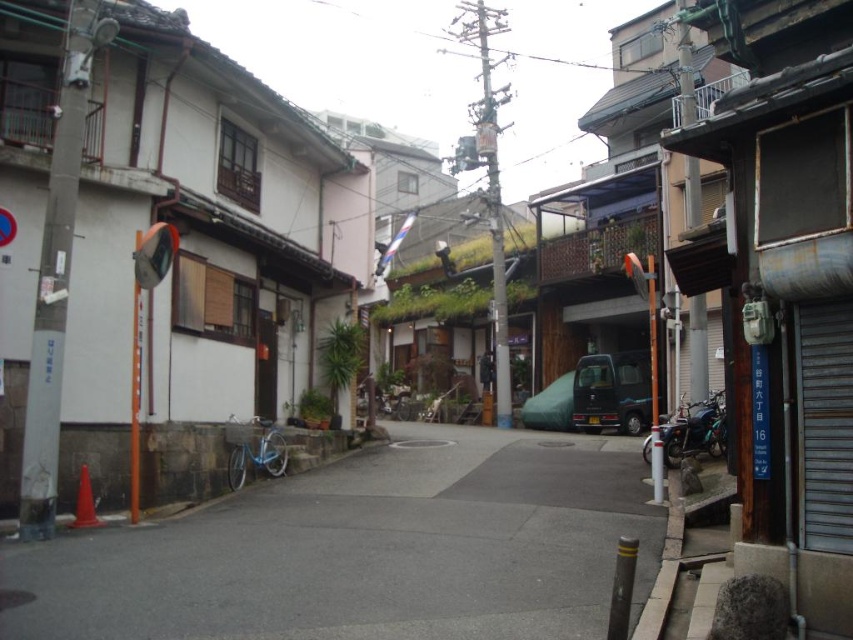
You are a delivery person trying to park your green fabric van at center in this narrow street. There is a smooth concrete sidewalk at center where you want to park. Can you park your van there without blocking the sidewalk?

The smooth concrete sidewalk at center is positioned under green fabric van at center, meaning the van is already occupying the sidewalk area. Therefore, parking the van there would block the sidewalk.

You are a delivery person standing on the smooth concrete sidewalk at center and need to reach the green fabric van at center. Which direction should you move to get closer to the van?

Since the smooth concrete sidewalk at center is closer to the viewer than the green fabric van at center, you should move forward along the sidewalk towards the van to get closer.

You are standing at the entrance of the white building on the left side of the street. You want to walk to the smooth concrete sidewalk at center. Which direction should you walk?

You should walk forward towards the smooth concrete sidewalk at center, which is located at point [364,548] in the image.